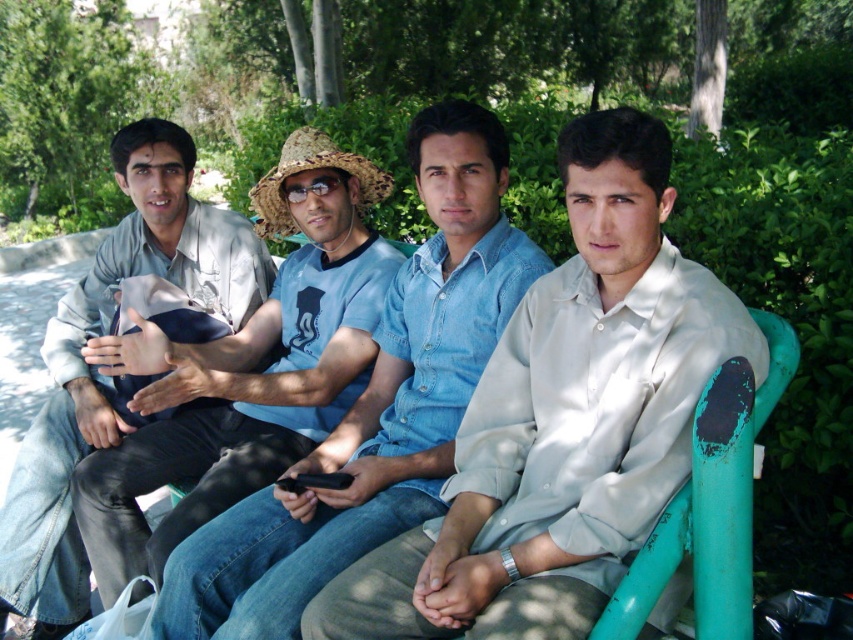
Who is more distant from viewer, (331,627) or (311,444)?

Point (311,444)

Can you confirm if light blue denim shirt at center is positioned to the right of matte blue shirt at center?

Indeed, light blue denim shirt at center is positioned on the right side of matte blue shirt at center.

Between point (598, 324) and point (254, 228), which one is positioned in front?

Point (598, 324) is more forward.

Identify the location of light blue denim shirt at center. This screenshot has width=853, height=640. (563, 420).

Based on the photo, can you confirm if denim shirt at center is positioned below light beige shirt at left?

Incorrect, denim shirt at center is not positioned below light beige shirt at left.

I want to click on denim shirt at center, so click(375, 404).

Measure the distance between point (422, 180) and camera.

A distance of 2.03 meters exists between point (422, 180) and camera.

Find the location of a particular element. The width and height of the screenshot is (853, 640). denim shirt at center is located at coordinates (375, 404).

Does matte blue shirt at center have a smaller size compared to light beige shirt at left?

Incorrect, matte blue shirt at center is not smaller in size than light beige shirt at left.

Is point (264, 376) in front of point (151, 147)?

Yes, point (264, 376) is closer to viewer.

The image size is (853, 640). What are the coordinates of `matte blue shirt at center` in the screenshot? It's located at (x=248, y=369).